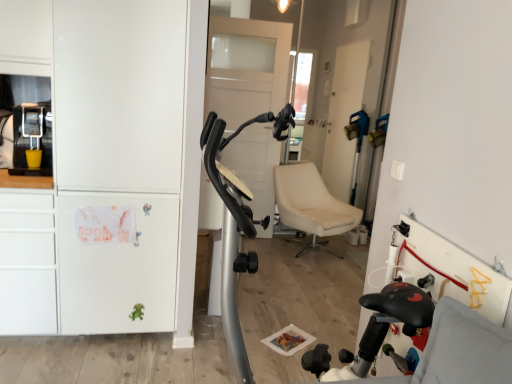
Describe the element at coordinates (32, 138) in the screenshot. I see `matte black coffee machine at left` at that location.

Locate an element on the screen. This screenshot has width=512, height=384. matte black coffee machine at left is located at coordinates pos(32,138).

You are a GUI agent. You are given a task and a screenshot of the screen. Output one action in this format:
    pyautogui.click(x=<x>, y=<y>)
    Task: Click on the white matte cabinet at left
    
    Given the screenshot: What is the action you would take?
    pyautogui.click(x=104, y=167)

This screenshot has height=384, width=512. What do you see at coordinates (104, 167) in the screenshot?
I see `white matte cabinet at left` at bounding box center [104, 167].

What are the coordinates of `matte black coffee machine at left` in the screenshot? It's located at (32, 138).

Which object is positioned more to the right, white matte cabinet at left or matte black coffee machine at left?

From the viewer's perspective, white matte cabinet at left appears more on the right side.

Is white matte cabinet at left further to camera compared to matte black coffee machine at left?

No, white matte cabinet at left is closer to the viewer.

Is point (136, 103) farther from camera compared to point (31, 109)?

That is False.

From the image's perspective, is white matte cabinet at left located beneath matte black coffee machine at left?

Yes, from the image's perspective, white matte cabinet at left is beneath matte black coffee machine at left.

From a real-world perspective, is white matte cabinet at left above or below matte black coffee machine at left?

From a real-world perspective, white matte cabinet at left is physically below matte black coffee machine at left.

Which object is wider, white matte cabinet at left or matte black coffee machine at left?

Wider between the two is white matte cabinet at left.

Considering the relative sizes of white matte cabinet at left and matte black coffee machine at left in the image provided, is white matte cabinet at left shorter than matte black coffee machine at left?

No, white matte cabinet at left is not shorter than matte black coffee machine at left.

Considering the sizes of white matte cabinet at left and matte black coffee machine at left in the image, is white matte cabinet at left bigger or smaller than matte black coffee machine at left?

In the image, white matte cabinet at left appears to be larger than matte black coffee machine at left.

Is white matte cabinet at left situated inside matte black coffee machine at left or outside?

white matte cabinet at left is spatially situated outside matte black coffee machine at left.

Can you see white matte cabinet at left touching matte black coffee machine at left?

white matte cabinet at left and matte black coffee machine at left are clearly separated.

Is white matte cabinet at left oriented towards matte black coffee machine at left?

No, white matte cabinet at left is not facing towards matte black coffee machine at left.

How many degrees apart are the facing directions of white matte cabinet at left and matte black coffee machine at left?

They differ by 0.721 degrees in their facing directions.

There is a white matte cabinet at left. Identify the location of appliance above it (from a real-world perspective). (32, 138).

Can you confirm if matte black coffee machine at left is positioned to the left of white matte cabinet at left?

Indeed, matte black coffee machine at left is positioned on the left side of white matte cabinet at left.

Between matte black coffee machine at left and white matte cabinet at left, which one is positioned behind?

matte black coffee machine at left is more distant.

Which is in front, point (16, 148) or point (147, 310)?

The point (16, 148) is more forward.

From the image's perspective, who appears lower, matte black coffee machine at left or white matte cabinet at left?

From the image's view, white matte cabinet at left is below.

From a real-world perspective, is matte black coffee machine at left positioned under white matte cabinet at left based on gravity?

Incorrect, from a real-world perspective, matte black coffee machine at left is higher than white matte cabinet at left.

In terms of width, does matte black coffee machine at left look wider or thinner when compared to white matte cabinet at left?

Considering their sizes, matte black coffee machine at left looks slimmer than white matte cabinet at left.

From their relative heights in the image, would you say matte black coffee machine at left is taller or shorter than white matte cabinet at left?

Considering their sizes, matte black coffee machine at left has less height than white matte cabinet at left.

Does matte black coffee machine at left have a smaller size compared to white matte cabinet at left?

Indeed, matte black coffee machine at left has a smaller size compared to white matte cabinet at left.

Is matte black coffee machine at left located outside white matte cabinet at left?

That's correct, matte black coffee machine at left is outside of white matte cabinet at left.

Is matte black coffee machine at left far away from white matte cabinet at left?

No, matte black coffee machine at left is not far away from white matte cabinet at left.

Does matte black coffee machine at left turn towards white matte cabinet at left?

No, matte black coffee machine at left is not turned towards white matte cabinet at left.

Where is `appliance above the white matte cabinet at left (from a real-world perspective)`? Image resolution: width=512 pixels, height=384 pixels. appliance above the white matte cabinet at left (from a real-world perspective) is located at coordinates (32, 138).

Where is `dresser that is under the matte black coffee machine at left (from a real-world perspective)`? This screenshot has height=384, width=512. dresser that is under the matte black coffee machine at left (from a real-world perspective) is located at coordinates (104, 167).

Find the location of a particular element. The width and height of the screenshot is (512, 384). appliance above the white matte cabinet at left (from the image's perspective) is located at coordinates (32, 138).